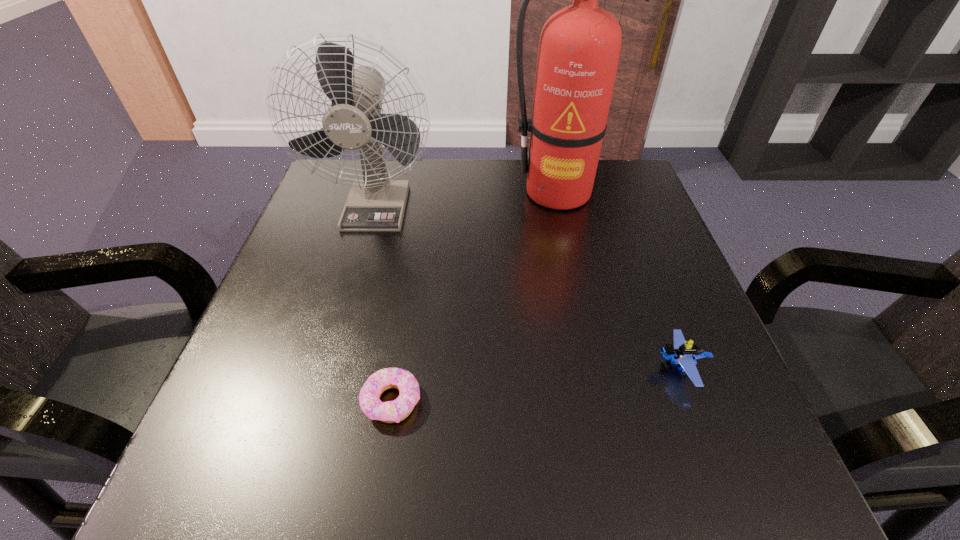
This screenshot has width=960, height=540. What are the coordinates of `free region at the right edge of the desktop` in the screenshot? It's located at (620, 317).

The image size is (960, 540). I want to click on free space at the far left corner, so click(x=345, y=178).

Find the location of a particular element. vacant space at the near left corner of the desktop is located at coordinates (258, 438).

At what (x,y) coordinates should I click in order to perform the action: click on vacant space at the far right corner. Please return your answer as a coordinate pair (x, y). Image resolution: width=960 pixels, height=540 pixels. Looking at the image, I should click on (591, 211).

This screenshot has height=540, width=960. Find the location of `vacant space in between the second shortest object and the tallest object`. vacant space in between the second shortest object and the tallest object is located at coordinates (618, 280).

Image resolution: width=960 pixels, height=540 pixels. I want to click on free area in between the doughnut and the Lego, so click(x=536, y=384).

What are the coordinates of `vacant space that is in between the third tallest object and the tallest object` in the screenshot? It's located at (618, 280).

In order to click on vacant area that lies between the third shortest object and the doughnut in this screenshot , I will do `click(385, 303)`.

Identify the location of vacant area between the doughnut and the second tallest object. (385, 303).

Locate an element on the screen. This screenshot has width=960, height=540. free point between the fire extinguisher and the shortest object is located at coordinates 474,296.